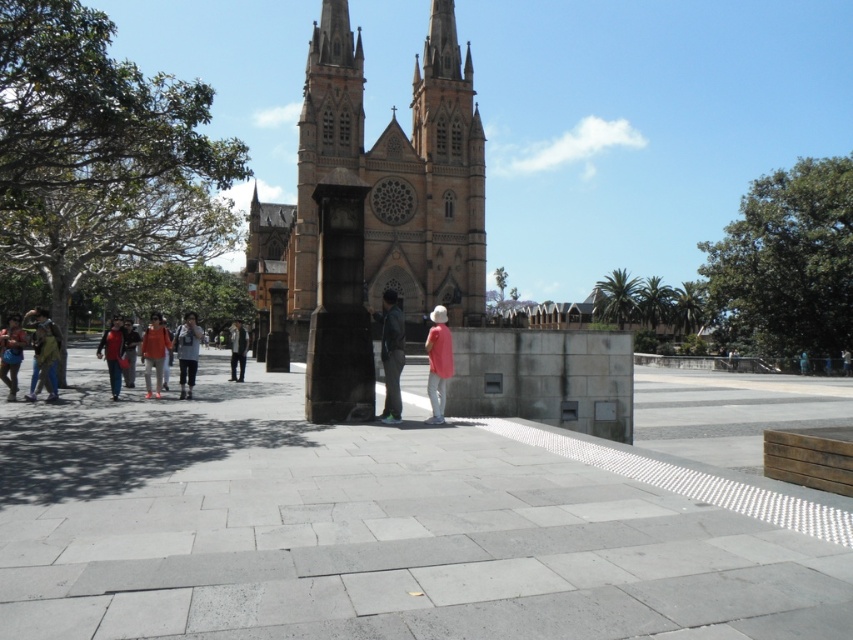
You are a GUI agent. You are given a task and a screenshot of the screen. Output one action in this format:
    pyautogui.click(x=<x>, y=<y>)
    Task: Click on the pink fabric hat at center
    
    Given the screenshot: What is the action you would take?
    pyautogui.click(x=438, y=362)

Between pink fabric hat at center and denim jacket at lower left, which one appears on the right side from the viewer's perspective?

pink fabric hat at center

I want to click on pink fabric hat at center, so click(x=438, y=362).

Between point (374, 211) and point (398, 385), which one is positioned in front?

Point (398, 385)

Image resolution: width=853 pixels, height=640 pixels. I want to click on brown stone church at center, so pyautogui.click(x=381, y=182).

The width and height of the screenshot is (853, 640). Find the location of `brown stone church at center`. brown stone church at center is located at coordinates (381, 182).

Which is behind, point (297, 314) or point (24, 337)?

The point (297, 314) is more distant.

Is brown stone church at center below denim jacket at left?

No.

Is point (445, 22) positioned after point (0, 356)?

Yes, point (445, 22) is behind point (0, 356).

The height and width of the screenshot is (640, 853). In order to click on brown stone church at center in this screenshot , I will do click(x=381, y=182).